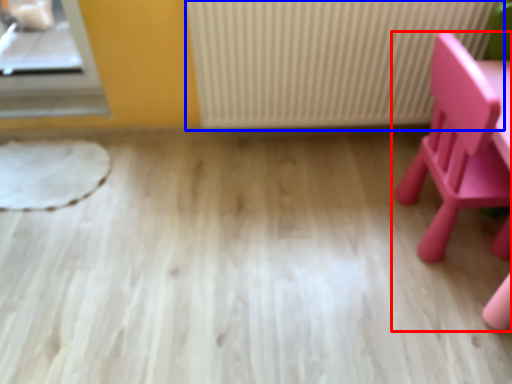
Question: Which point is closer to the camera, chair (highlighted by a red box) or radiator (highlighted by a blue box)?

Choices:
 (A) chair
 (B) radiator

Answer: (A)